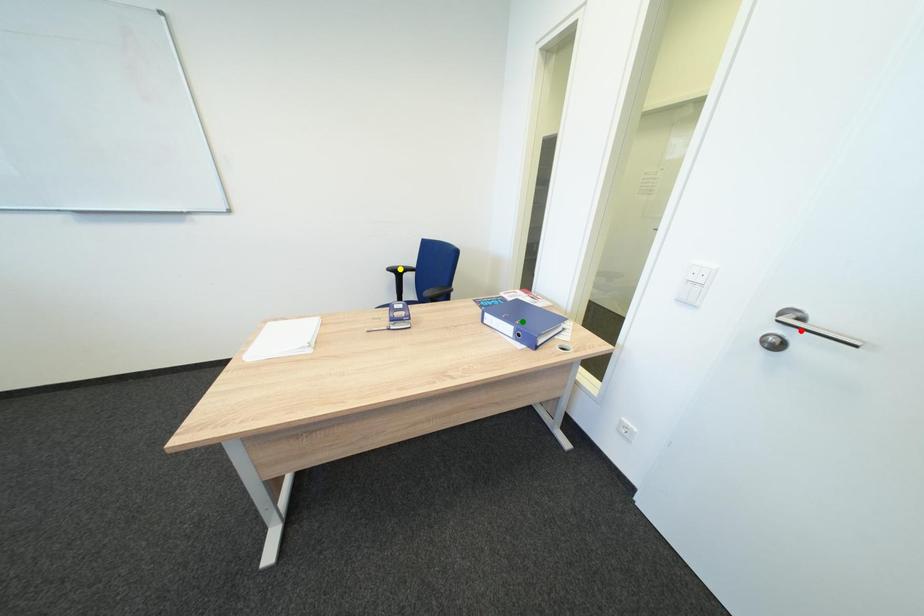
Order these from farthest to nearest:
A) green point
B) yellow point
C) red point

yellow point, green point, red point